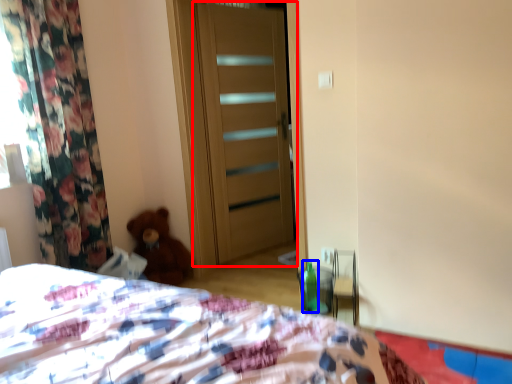
Question: Which object appears farthest to the camera in this image, door (highlighted by a red box) or bottle (highlighted by a blue box)?

Choices:
 (A) door
 (B) bottle

Answer: (A)